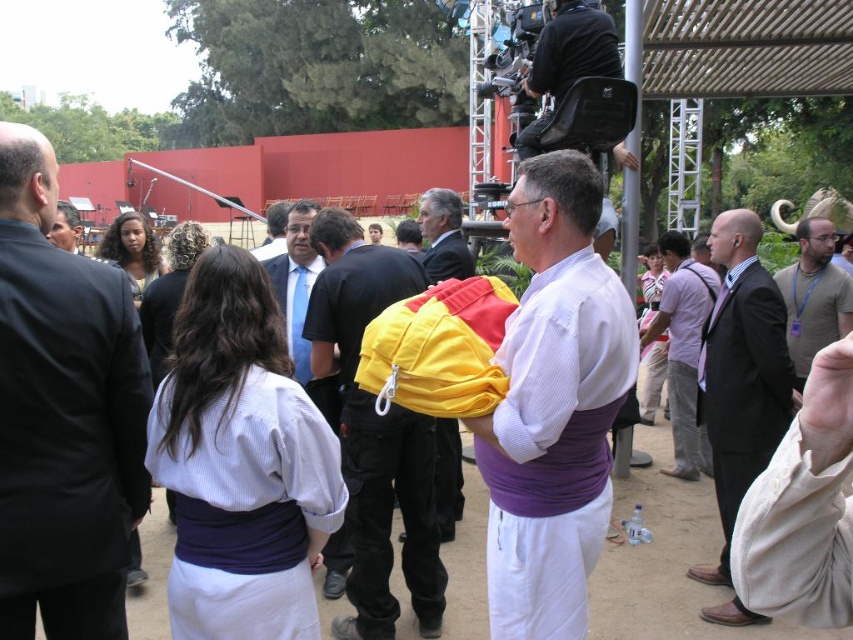
Question: Is white matte shirt at center smaller than blue fabric shirt at center?

Choices:
 (A) yes
 (B) no

Answer: (B)

Question: Which is farther from the black suit at left?

Choices:
 (A) light purple shirt at center
 (B) black leather chair at upper center

Answer: (A)

Question: Does black suit at left appear over yellow fabric backpack at center?

Choices:
 (A) yes
 (B) no

Answer: (A)

Question: Which point is closer to the camera?

Choices:
 (A) yellow fabric jacket at center
 (B) black leather chair at upper center
 (C) white matte shirt at center

Answer: (C)

Question: Which object appears farthest from the camera in this image?

Choices:
 (A) white matte shirt at center
 (B) yellow fabric jacket at center

Answer: (B)

Question: Does black suit at left lie in front of yellow fabric jacket at center?

Choices:
 (A) no
 (B) yes

Answer: (B)